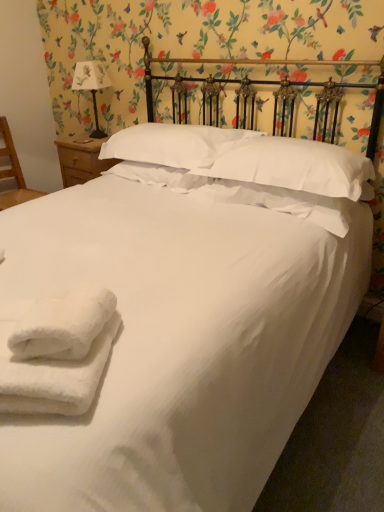
Question: From the image's perspective, is white paper-covered lampshade at upper left above or below white textured pillow at center, positioned as the 2th pillow in right-to-left order?

Choices:
 (A) above
 (B) below

Answer: (A)

Question: Do you think white paper-covered lampshade at upper left is within white textured pillow at center, the 2th pillow when ordered from left to right, or outside of it?

Choices:
 (A) inside
 (B) outside

Answer: (B)

Question: Which is farther from the white fluffy towels at lower left?

Choices:
 (A) white soft pillow at upper center, positioned as the third pillow in left-to-right order
 (B) white textured pillow at center, positioned as the 2th pillow in right-to-left order
 (C) white soft pillow at center, which is counted as the third pillow, starting from the right
 (D) wooden nightstand at left
 (E) white paper-covered lampshade at upper left

Answer: (E)

Question: Which is farther from the white soft pillow at center, which is counted as the third pillow, starting from the right?

Choices:
 (A) white fluffy towels at lower left
 (B) white soft pillow at upper center, positioned as the third pillow in left-to-right order
 (C) wooden nightstand at left
 (D) wooden chair at left
 (E) white paper-covered lampshade at upper left

Answer: (A)